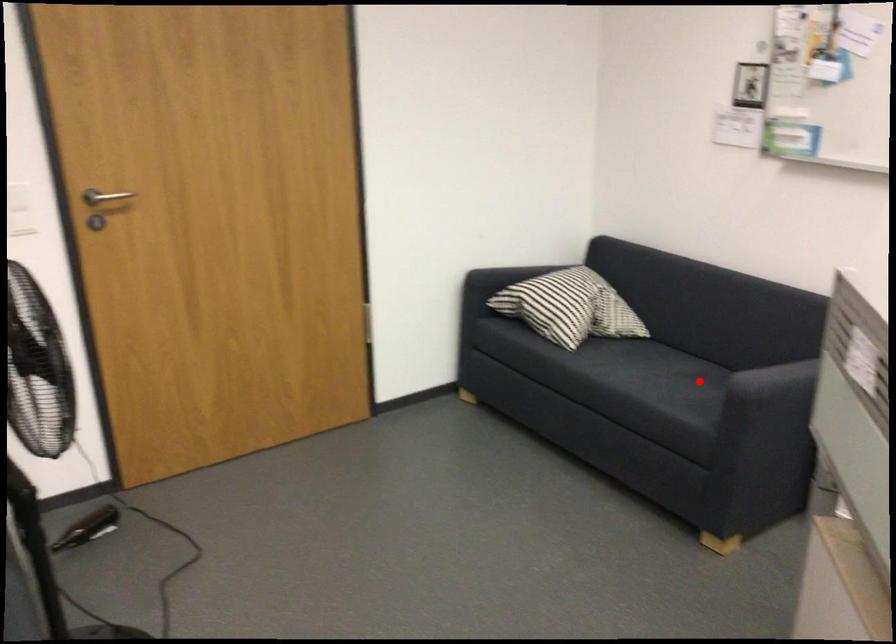
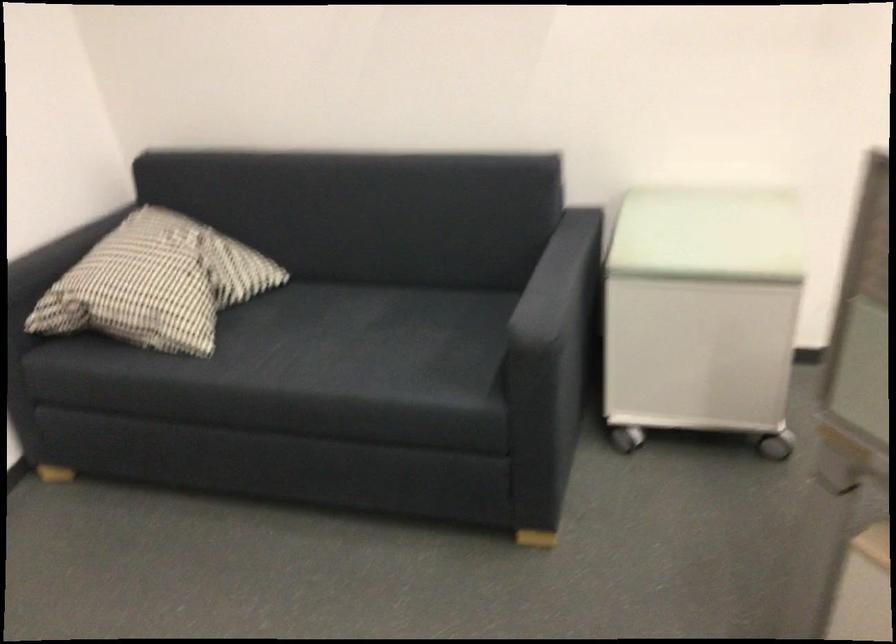
Locate, in the second image, the point that corresponds to the highlighted location in the first image.

(410, 327)